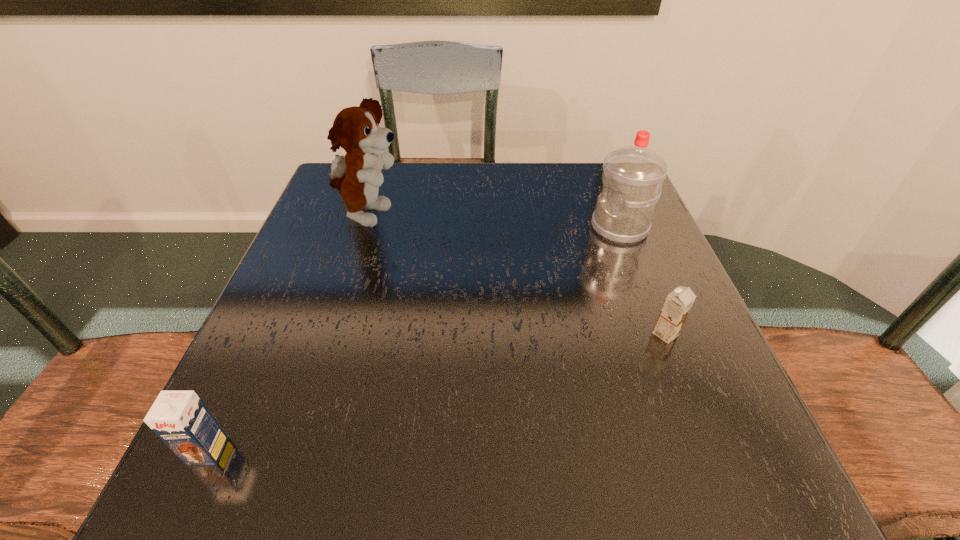
Locate an element on the screen. The height and width of the screenshot is (540, 960). free area in between the right chocolate milk and the third object from right to left is located at coordinates (517, 275).

The width and height of the screenshot is (960, 540). Find the location of `vacant area between the farther chocolate milk and the puppy`. vacant area between the farther chocolate milk and the puppy is located at coordinates point(517,275).

I want to click on blank region between the nearest object and the second object from left to right, so click(x=288, y=334).

This screenshot has height=540, width=960. I want to click on free space that is in between the shortest object and the leftmost object, so click(437, 392).

What are the coordinates of `free spot between the third object from right to left and the right chocolate milk` in the screenshot? It's located at (517, 275).

What are the coordinates of `unoccupied position between the water bottle and the leftmost object` in the screenshot? It's located at (414, 339).

Where is `unoccupied position between the third shortest object and the second object from left to right`? unoccupied position between the third shortest object and the second object from left to right is located at coordinates (494, 222).

Where is `object that stands as the second closest to the second nearest object`? object that stands as the second closest to the second nearest object is located at coordinates (357, 175).

Locate which object is the third closest to the shortest object. Please provide its 2D coordinates. Your answer should be formatted as a tuple, i.e. [(x, y)], where the tuple contains the x and y coordinates of a point satisfying the conditions above.

[(181, 420)]

Locate an element on the screen. The width and height of the screenshot is (960, 540). free space that satisfies the following two spatial constraints: 1. on the handle side of the second nearest object; 2. on the left side of the third shortest object is located at coordinates (660, 334).